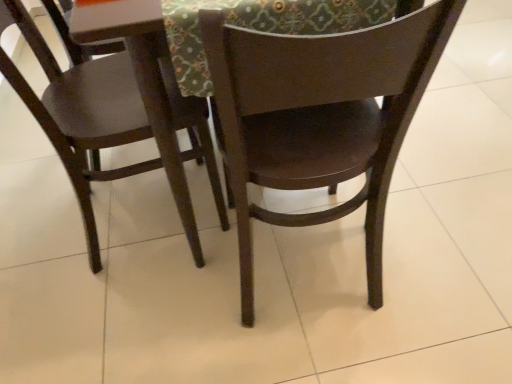
The height and width of the screenshot is (384, 512). Find the location of `unoccupied region to the right of dark wood chair at center, the first chair viewed from the right`. unoccupied region to the right of dark wood chair at center, the first chair viewed from the right is located at coordinates (441, 253).